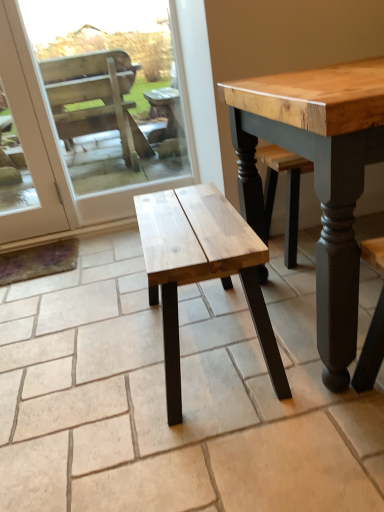
Find the location of `free space below natural wood bench at center (from a real-world perspective)`. free space below natural wood bench at center (from a real-world perspective) is located at coordinates (214, 345).